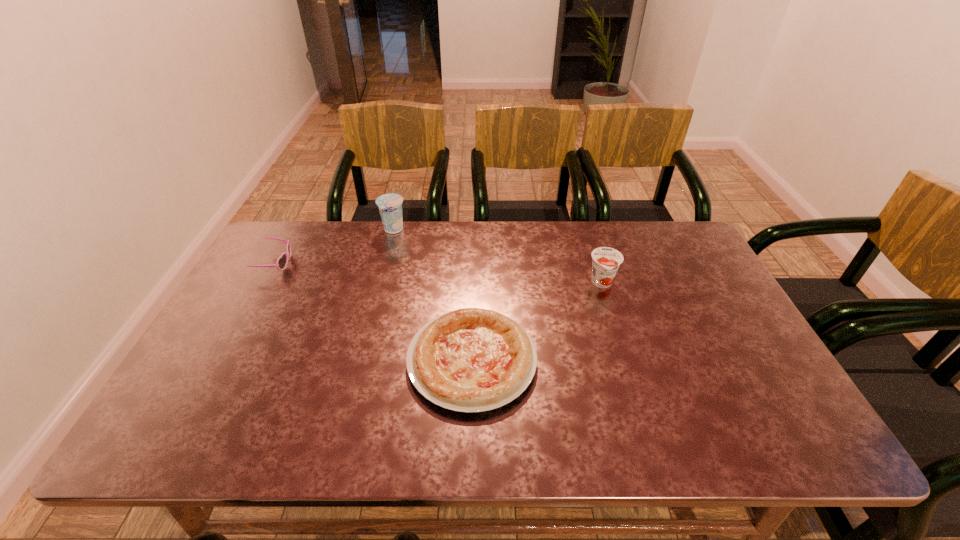
At what (x,y) coordinates should I click in order to perform the action: click on vacant region that satisfies the following two spatial constraints: 1. on the front-facing side of the third object from left to right; 2. on the right side of the leftmost object. Please return your answer as a coordinate pair (x, y). This screenshot has width=960, height=540. Looking at the image, I should click on (222, 360).

Locate an element on the screen. vacant space that satisfies the following two spatial constraints: 1. on the front-facing side of the sunglasses; 2. on the right side of the rightmost object is located at coordinates (265, 284).

Identify the location of vacant area that satisfies the following two spatial constraints: 1. on the back side of the rightmost object; 2. on the front-facing side of the leftmost object. The height and width of the screenshot is (540, 960). (596, 263).

You are a GUI agent. You are given a task and a screenshot of the screen. Output one action in this format:
    pyautogui.click(x=<x>, y=<y>)
    Task: Click on the vacant point that satisfies the following two spatial constraints: 1. on the front-facing side of the second tallest object; 2. on the left side of the sunglasses
    Image resolution: width=960 pixels, height=540 pixels.
    Given the screenshot: What is the action you would take?
    pyautogui.click(x=265, y=284)

The width and height of the screenshot is (960, 540). Identify the location of vacant space that satisfies the following two spatial constraints: 1. on the front-facing side of the leftmost object; 2. on the left side of the third object from left to right. (222, 360).

This screenshot has width=960, height=540. Identify the location of free location that satisfies the following two spatial constraints: 1. on the front-facing side of the leftmost object; 2. on the right side of the third shortest object. (265, 284).